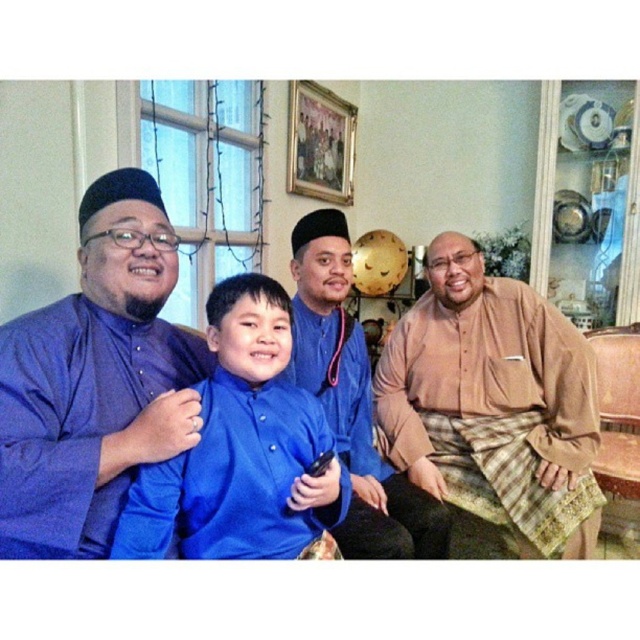
From the picture: Between blue satin kurta at center and beige textured shirt at right, which one has less height?

blue satin kurta at center is shorter.

Does blue satin kurta at center appear on the left side of beige textured shirt at right?

Correct, you'll find blue satin kurta at center to the left of beige textured shirt at right.

Does point (198, 356) come closer to viewer compared to point (545, 362)?

Yes, it is.

Where is `blue satin kurta at center`? Image resolution: width=640 pixels, height=640 pixels. blue satin kurta at center is located at coordinates (96, 380).

How much distance is there between beige textured shirt at right and blue satin shirt at center?

They are 95.40 centimeters apart.

Is point (493, 323) positioned after point (269, 410)?

Yes, point (493, 323) is farther from viewer.

Does point (552, 438) come behind point (284, 364)?

Yes, it is behind point (284, 364).

The image size is (640, 640). Identify the location of beige textured shirt at right. [x=493, y=404].

Measure the distance between blue satin kurta at center and matte blue kurta at center.

A distance of 23.73 inches exists between blue satin kurta at center and matte blue kurta at center.

Does blue satin kurta at center have a greater width compared to matte blue kurta at center?

In fact, blue satin kurta at center might be narrower than matte blue kurta at center.

Is point (3, 528) closer to camera compared to point (356, 552)?

Yes, point (3, 528) is in front of point (356, 552).

This screenshot has height=640, width=640. What are the coordinates of `blue satin kurta at center` in the screenshot? It's located at (96, 380).